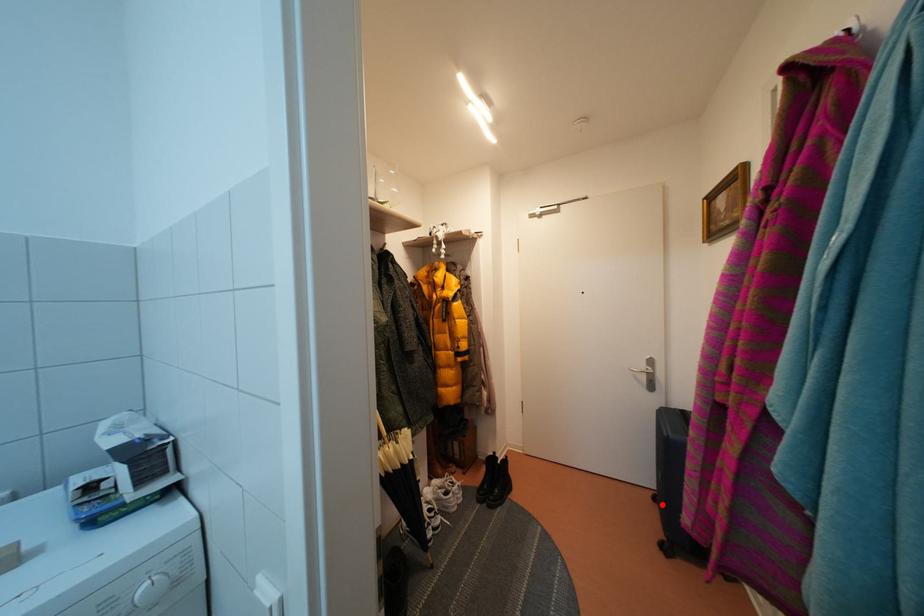
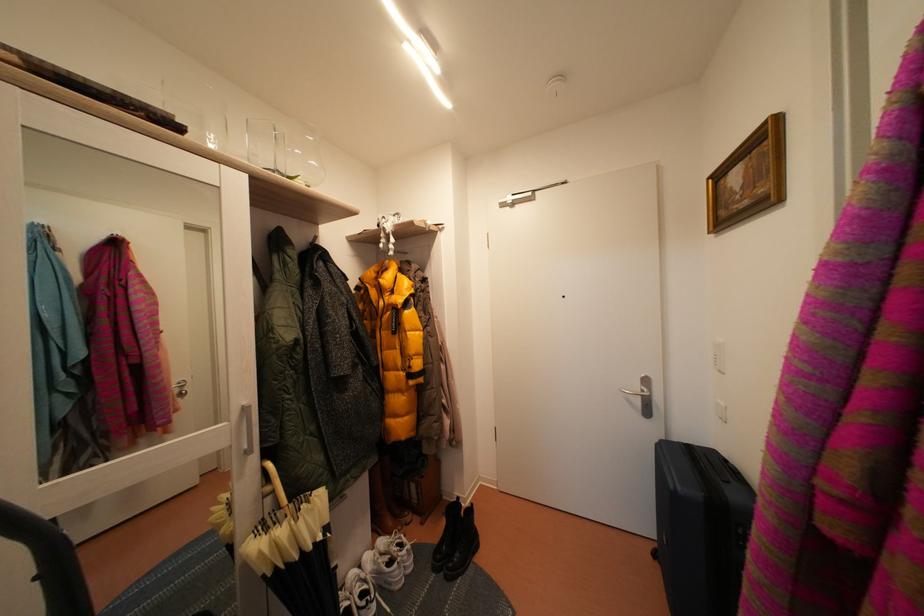
Where in the second image is the point corresponding to the highlighted location from the first image?

(662, 561)